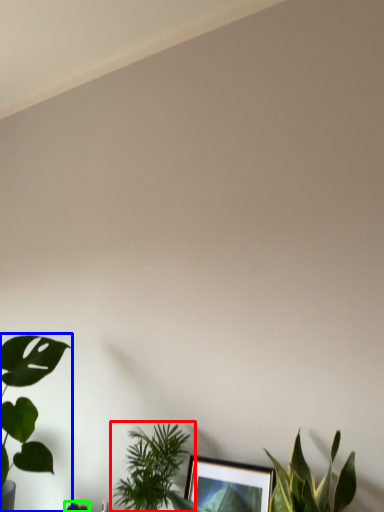
Question: Which is nearer to the houseplant (highlighted by a red box)? houseplant (highlighted by a blue box) or plant (highlighted by a green box).

Choices:
 (A) houseplant
 (B) plant

Answer: (A)